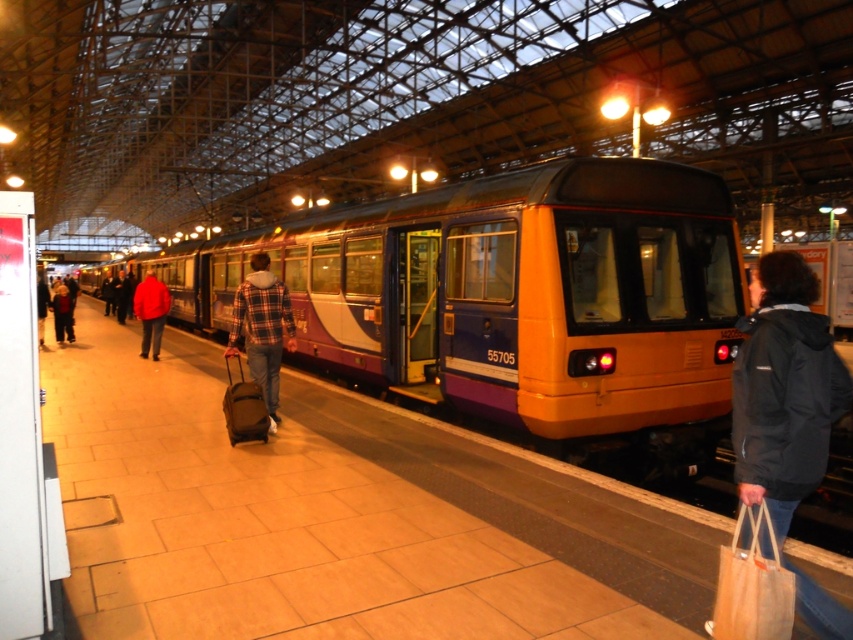
Question: In this image, where is metallic purple train at center located relative to dark blue jeans at lower left?

Choices:
 (A) above
 (B) below

Answer: (A)

Question: Does dark gray jacket at right have a smaller size compared to dark blue jeans at lower left?

Choices:
 (A) no
 (B) yes

Answer: (B)

Question: Can you confirm if metallic purple train at center is positioned above plaid fabric jacket at center?

Choices:
 (A) no
 (B) yes

Answer: (B)

Question: Which of the following is the closest to the observer?

Choices:
 (A) plaid fabric jacket at center
 (B) red jacket at left
 (C) dark blue jeans at lower left

Answer: (A)

Question: Which object appears closest to the camera in this image?

Choices:
 (A) dark blue jeans at lower left
 (B) plaid fabric jacket at center

Answer: (B)

Question: Among these objects, which one is nearest to the camera?

Choices:
 (A) dark gray jacket at right
 (B) metallic purple train at center

Answer: (A)